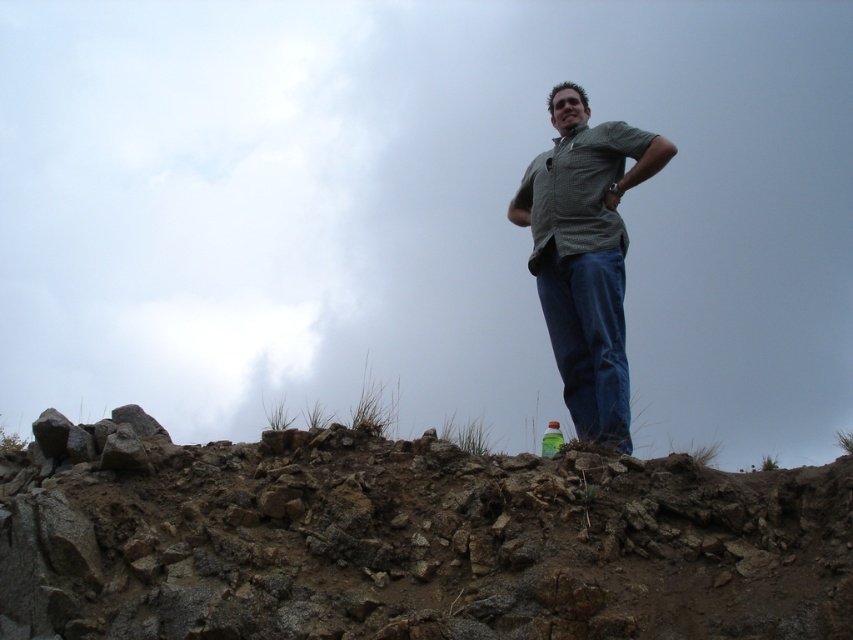
From the picture: You are a hiker who wants to place a small marker between the two points, point [548,257] and point [558,442]. Which point is closer to you so that you can place the marker in front of both points?

Point [548,257] is closer to you than point [558,442], so you should place the marker in front of point [548,257] to ensure it is visible from both points.

You are a photographer trying to capture the person in the scene. Since the checkered fabric shirt at center and the blue denim jeans at center are both visible, which clothing item appears shorter in the photo?

The checkered fabric shirt at center is shorter than the blue denim jeans at center, so the checkered fabric shirt at center will appear shorter in the photo.